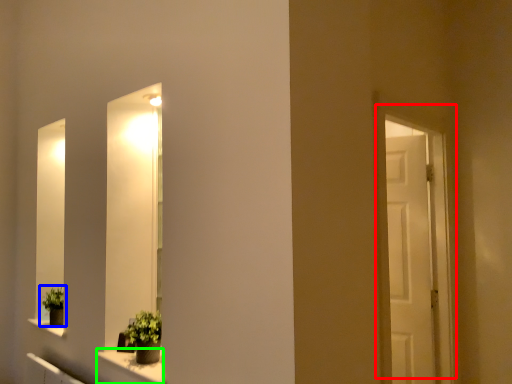
Question: Considering the real-world distances, which object is farthest from door (highlighted by a red box)? houseplant (highlighted by a blue box) or window sill (highlighted by a green box)?

Choices:
 (A) houseplant
 (B) window sill

Answer: (A)